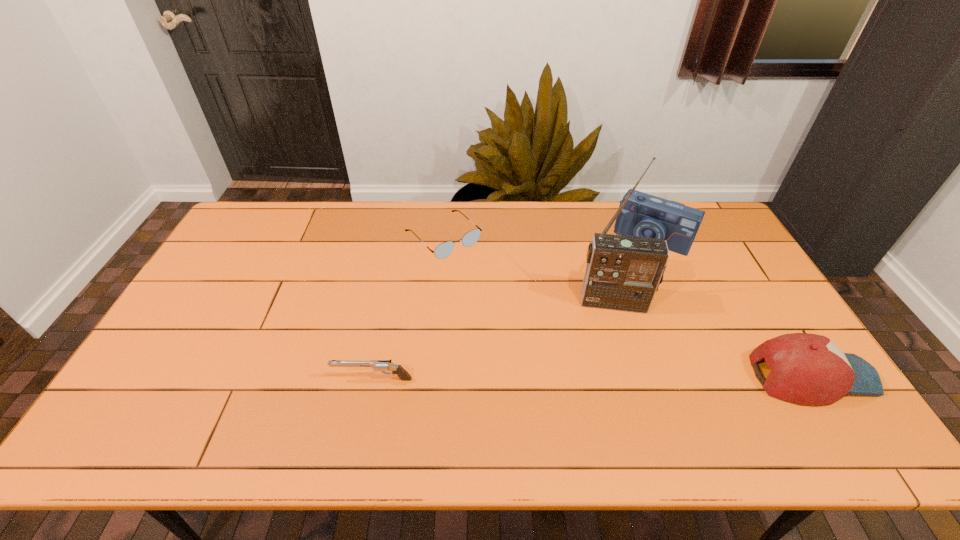
Select which object is the third closest to the pistol. Please provide its 2D coordinates. Your answer should be formatted as a tuple, i.e. [(x, y)], where the tuple contains the x and y coordinates of a point satisfying the conditions above.

[(644, 215)]

Where is `free space that satisfies the following two spatial constraints: 1. on the front side of the third shortest object; 2. on the front-facing side of the spectacles`? free space that satisfies the following two spatial constraints: 1. on the front side of the third shortest object; 2. on the front-facing side of the spectacles is located at coordinates (430, 376).

Locate an element on the screen. The width and height of the screenshot is (960, 540). blank space that satisfies the following two spatial constraints: 1. on the front side of the baseball cap; 2. on the front-facing side of the shortest object is located at coordinates (430, 376).